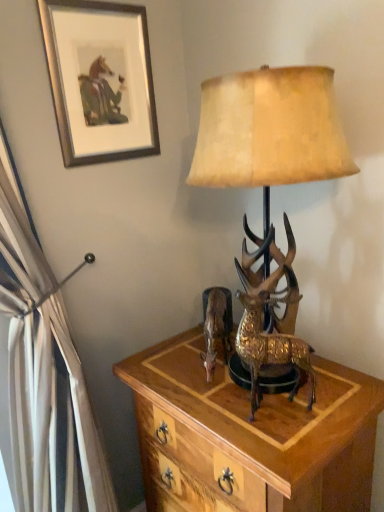
I want to click on blank area to the left of metallic gold reindeer at center, so click(168, 369).